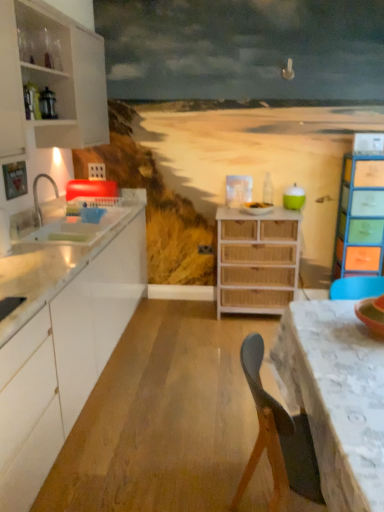
Question: Should I look upward or downward to see woven wood chest of drawers at center, which ranks as the 2th chest of drawers in right-to-left order?

Choices:
 (A) up
 (B) down

Answer: (B)

Question: Considering the relative sizes of white matte cabinet at left, marked as the first cabinetry in a top-to-bottom arrangement, and white glossy cabinet at left, positioned as the 1th cabinetry in bottom-to-top order, in the image provided, is white matte cabinet at left, marked as the first cabinetry in a top-to-bottom arrangement, shorter than white glossy cabinet at left, positioned as the 1th cabinetry in bottom-to-top order,?

Choices:
 (A) no
 (B) yes

Answer: (B)

Question: Does white matte cabinet at left, placed as the second cabinetry when sorted from bottom to top, appear on the left side of white glossy cabinet at left, which appears as the 2th cabinetry when viewed from the top?

Choices:
 (A) yes
 (B) no

Answer: (A)

Question: Considering the relative sizes of white matte cabinet at left, marked as the first cabinetry in a top-to-bottom arrangement, and white glossy cabinet at left, which appears as the 2th cabinetry when viewed from the top, in the image provided, is white matte cabinet at left, marked as the first cabinetry in a top-to-bottom arrangement, bigger than white glossy cabinet at left, which appears as the 2th cabinetry when viewed from the top,?

Choices:
 (A) yes
 (B) no

Answer: (B)

Question: Does white matte cabinet at left, placed as the second cabinetry when sorted from bottom to top, lie in front of white glossy cabinet at left, positioned as the 1th cabinetry in bottom-to-top order?

Choices:
 (A) no
 (B) yes

Answer: (A)

Question: Are white matte cabinet at left, marked as the first cabinetry in a top-to-bottom arrangement, and white glossy cabinet at left, positioned as the 1th cabinetry in bottom-to-top order, far apart?

Choices:
 (A) no
 (B) yes

Answer: (B)

Question: Considering the relative positions of white matte cabinet at left, marked as the first cabinetry in a top-to-bottom arrangement, and white glossy cabinet at left, positioned as the 1th cabinetry in bottom-to-top order, in the image provided, is white matte cabinet at left, marked as the first cabinetry in a top-to-bottom arrangement, behind white glossy cabinet at left, positioned as the 1th cabinetry in bottom-to-top order,?

Choices:
 (A) no
 (B) yes

Answer: (B)

Question: Would you say white glossy sink at left is a long distance from white lace tablecloth at lower right?

Choices:
 (A) yes
 (B) no

Answer: (A)

Question: Is white glossy sink at left facing towards white lace tablecloth at lower right?

Choices:
 (A) no
 (B) yes

Answer: (A)

Question: From the image's perspective, would you say white glossy sink at left is shown under white lace tablecloth at lower right?

Choices:
 (A) yes
 (B) no

Answer: (B)

Question: Is white glossy sink at left wider than white lace tablecloth at lower right?

Choices:
 (A) yes
 (B) no

Answer: (B)

Question: Is white glossy sink at left in front of white lace tablecloth at lower right?

Choices:
 (A) yes
 (B) no

Answer: (B)

Question: From the image's perspective, does white glossy sink at left appear higher than white lace tablecloth at lower right?

Choices:
 (A) no
 (B) yes

Answer: (B)

Question: Could you tell me if woven wood chest of drawers at center, which is the first chest of drawers from left to right, is turned towards white lace tablecloth at lower right?

Choices:
 (A) yes
 (B) no

Answer: (A)